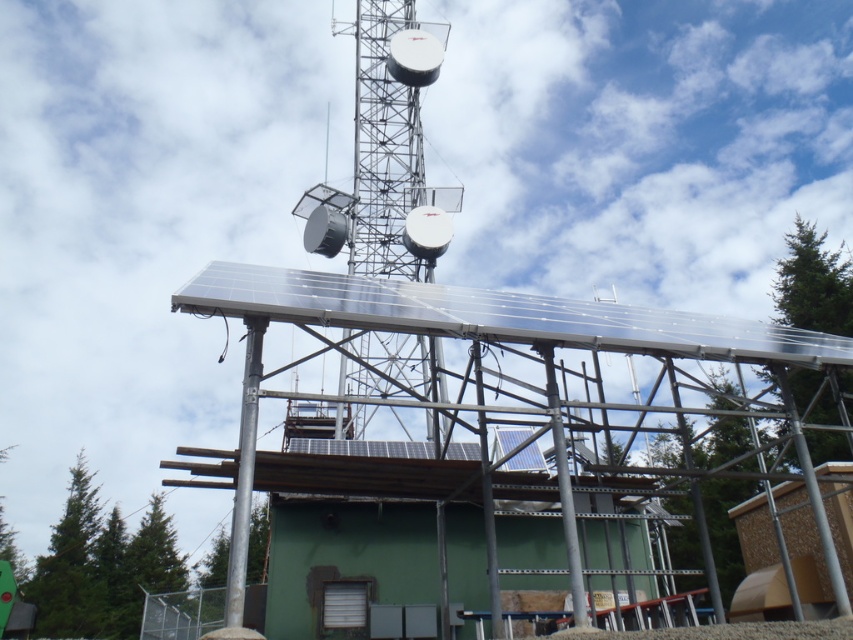
Does metallic silver tower at center have a greater width compared to silver metallic pole at center?

Indeed, metallic silver tower at center has a greater width compared to silver metallic pole at center.

Is metallic silver tower at center thinner than silver metallic pole at center?

Incorrect, metallic silver tower at center's width is not less than silver metallic pole at center's.

Measure the distance between point (392, 100) and camera.

A distance of 159.80 feet exists between point (392, 100) and camera.

Where is `metallic silver tower at center`? This screenshot has height=640, width=853. metallic silver tower at center is located at coordinates (381, 148).

Can you confirm if transparent glass solar panel at upper center is shorter than metallic silver tower at center?

Correct, transparent glass solar panel at upper center is not as tall as metallic silver tower at center.

Is transparent glass solar panel at upper center positioned before metallic silver tower at center?

Yes, transparent glass solar panel at upper center is in front of metallic silver tower at center.

Does point (183, 292) come in front of point (357, 200)?

Yes, point (183, 292) is in front of point (357, 200).

Where is `transparent glass solar panel at upper center`? This screenshot has height=640, width=853. transparent glass solar panel at upper center is located at coordinates (497, 316).

Which is in front, point (848, 346) or point (228, 621)?

Point (228, 621) is in front.

Consider the image. Which is more to the right, transparent glass solar panel at upper center or silver metallic pole at center?

transparent glass solar panel at upper center is more to the right.

Locate an element on the screen. This screenshot has height=640, width=853. transparent glass solar panel at upper center is located at coordinates (497, 316).